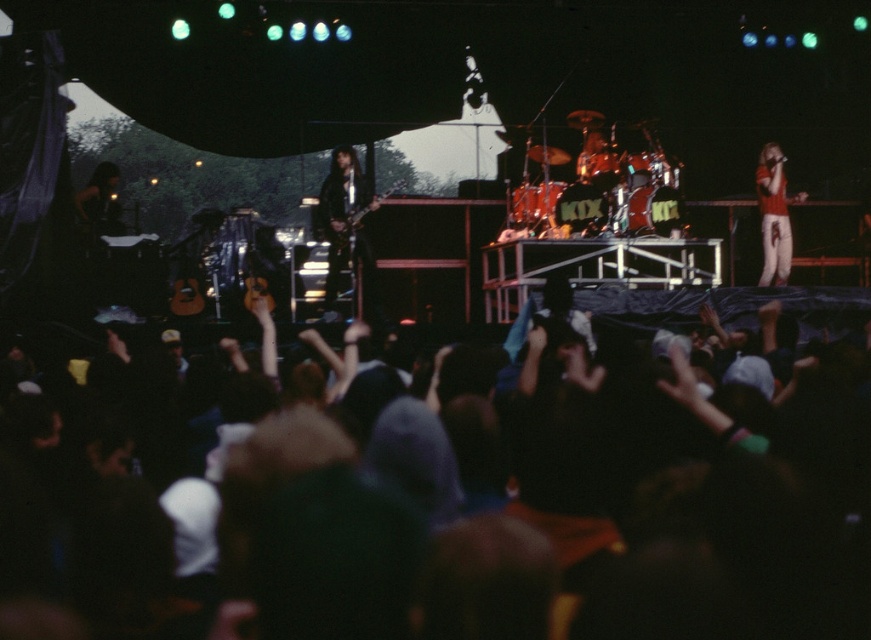
You are a stagehand who needs to place a new spotlight exactly at the center of the stage. The stage is a rectangle with coordinates from point A at the bottom left corner at point 0,0 to point B at the top right corner at point 1,1. The shiny red drum set at center is located at point 0.295, 0.696. Is the drum set closer to the center of the stage or to the bottom edge of the stage?

The center of the stage is at point [435,320]. The distance from the shiny red drum set at center at [605,188] to the center is sqrt of squared differences in x and y coordinates. Calculating sqrt of 0.205 squared plus 0.196 squared which is sqrt of 0.042025 plus 0.038416 equals sqrt of 0.080441 which is approximately 0.283. The distance to the bottom edge is the y coordinate 0.696, so 0.696 units away from bottom edge. Since 0.283 is less than 0.696, the drum set is closer to the center of the stage.

You are a photographer at the concert and want to capture a photo that includes both the black fabric crowd at lower center and the black leather guitar at center. Based on their positions, which object should be placed on the right side of the photo to ensure both are included?

The black fabric crowd at lower center should be placed on the right side of the photo because it is positioned on the right side of the black leather guitar at center, so arranging the crowd on the right will ensure both are included in the frame.

You are a photographer trying to capture a clear shot of both the shiny red drum set at center and the black leather guitar at center during the concert. Since the stage is very crowded, you need to adjust your camera focus. Which object should you focus on first if you want to ensure the closer one is in focus?

The shiny red drum set at center is shorter than the black leather guitar at center, so the black leather guitar at center is closer to the photographer. Therefore, focus on the black leather guitar at center first to ensure it is in focus.